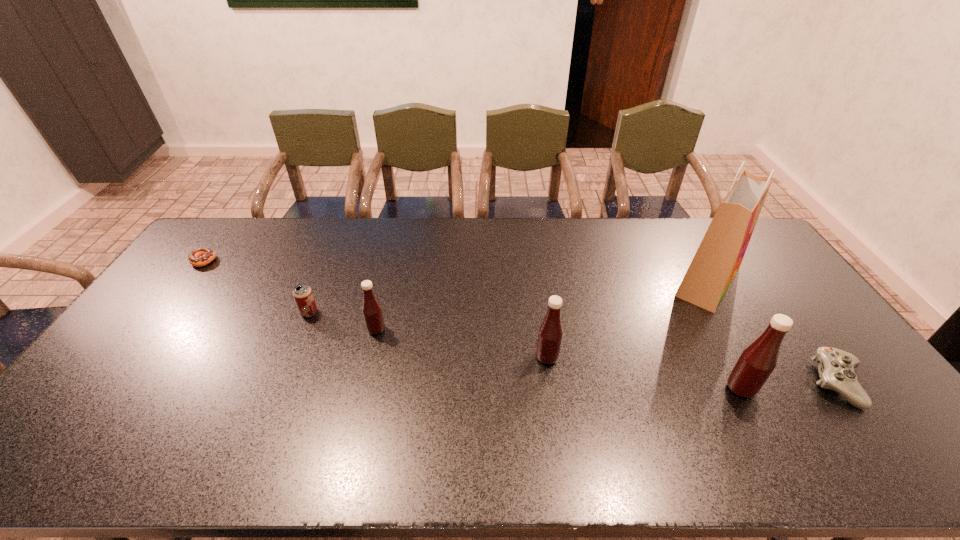
This screenshot has width=960, height=540. Find the location of `the farthest Tabasco sauce`. the farthest Tabasco sauce is located at coordinates (372, 311).

The width and height of the screenshot is (960, 540). I want to click on the shortest Tabasco sauce, so [x=372, y=311].

Image resolution: width=960 pixels, height=540 pixels. I want to click on the second nearest Tabasco sauce, so click(x=550, y=334).

I want to click on the fourth object from right to left, so click(550, 334).

Where is `the nearest Tabasco sauce`? The width and height of the screenshot is (960, 540). the nearest Tabasco sauce is located at coordinates (756, 363).

Find the location of a particular element. Image resolution: width=960 pixels, height=540 pixels. the shortest object is located at coordinates (201, 256).

The height and width of the screenshot is (540, 960). Identify the location of doughnut. (201, 256).

Identify the location of beer can. (302, 293).

Find the location of a particular element. the sixth object from right to left is located at coordinates (302, 293).

You are a GUI agent. You are given a task and a screenshot of the screen. Output one action in this format:
    pyautogui.click(x=<x>, y=<y>)
    Task: Click on the tallest object
    This screenshot has height=540, width=960.
    Given the screenshot: What is the action you would take?
    pyautogui.click(x=719, y=256)